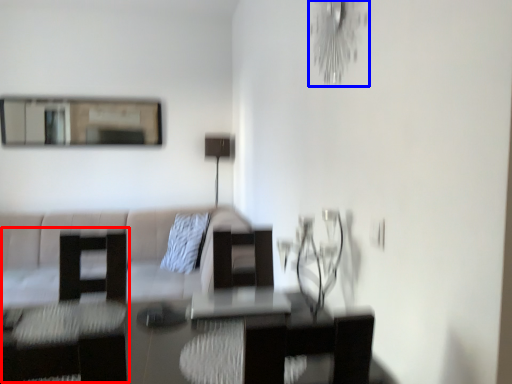
Question: Which object is further to the camera taking this photo, swivel chair (highlighted by a red box) or light fixture (highlighted by a blue box)?

Choices:
 (A) swivel chair
 (B) light fixture

Answer: (A)